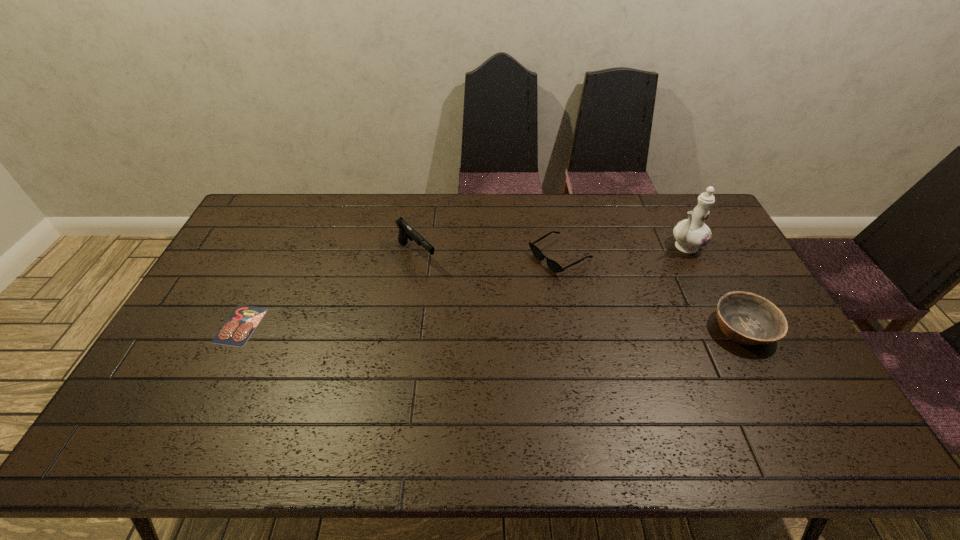
What are the coordinates of `the shortest object` in the screenshot? It's located at (237, 329).

Where is `the leftmost object`? The width and height of the screenshot is (960, 540). the leftmost object is located at coordinates pos(237,329).

Where is `bowl`? bowl is located at coordinates (746, 318).

At what (x,y) coordinates should I click in order to perform the action: click on chinaware. Please return your answer as a coordinate pair (x, y). Image resolution: width=960 pixels, height=540 pixels. Looking at the image, I should click on (692, 233).

Image resolution: width=960 pixels, height=540 pixels. I want to click on the second tallest object, so click(406, 232).

The height and width of the screenshot is (540, 960). What are the coordinates of `gun` in the screenshot? It's located at (406, 232).

Locate an element on the screen. The image size is (960, 540). the second shortest object is located at coordinates (553, 265).

Where is `sunglasses`? This screenshot has height=540, width=960. sunglasses is located at coordinates (553, 265).

You are a GUI agent. You are given a task and a screenshot of the screen. Output one action in this format:
    pyautogui.click(x=<x>, y=<y>)
    Task: Click on the vacant region located on the right of the salami
    This screenshot has height=540, width=960.
    Given the screenshot: What is the action you would take?
    pyautogui.click(x=358, y=325)

What are the coordinates of `free space located on the front of the bowl` in the screenshot? It's located at (772, 383).